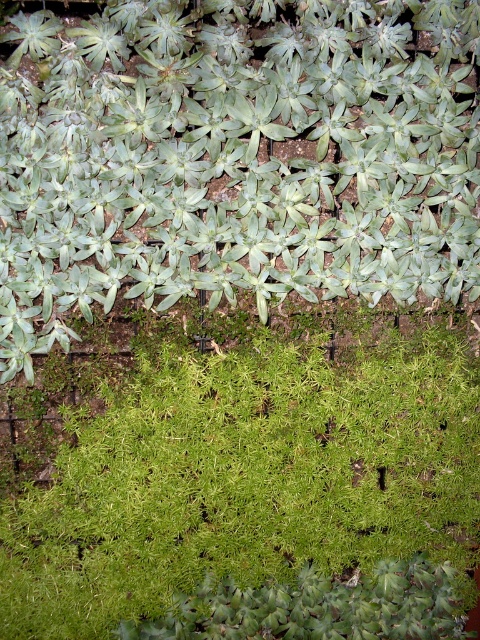
You are a gardener who wants to water the green leafy plant at upper center and the green fuzzy moss at bottom. Since you have a limited amount of water, you need to prioritize. Which plant is closer to you so you can water it first?

The green leafy plant at upper center is in front of the green fuzzy moss at bottom, so it is closer to you. You should water the green leafy plant at upper center first.

You are designing a garden layout and want to place both the green leafy plant at upper center and the green fuzzy moss at bottom in a way that maximizes space efficiency. Given their sizes, which plant should be placed in a narrower section of the garden bed?

The green leafy plant at upper center has a lesser width compared to the green fuzzy moss at bottom, so it should be placed in the narrower section of the garden bed to maximize space efficiency.

You are a gardener who wants to transplant the green leafy plant at upper center and the green fuzzy moss at bottom to a new pot. Which plant requires a larger pot in terms of diameter?

The green leafy plant at upper center requires a larger pot in terms of diameter because it has a larger size compared to the green fuzzy moss at bottom.